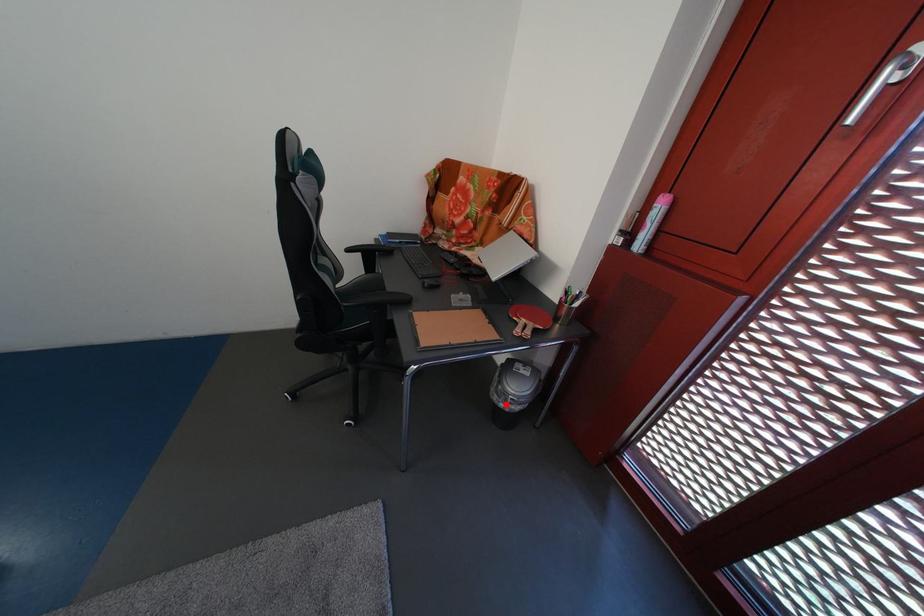
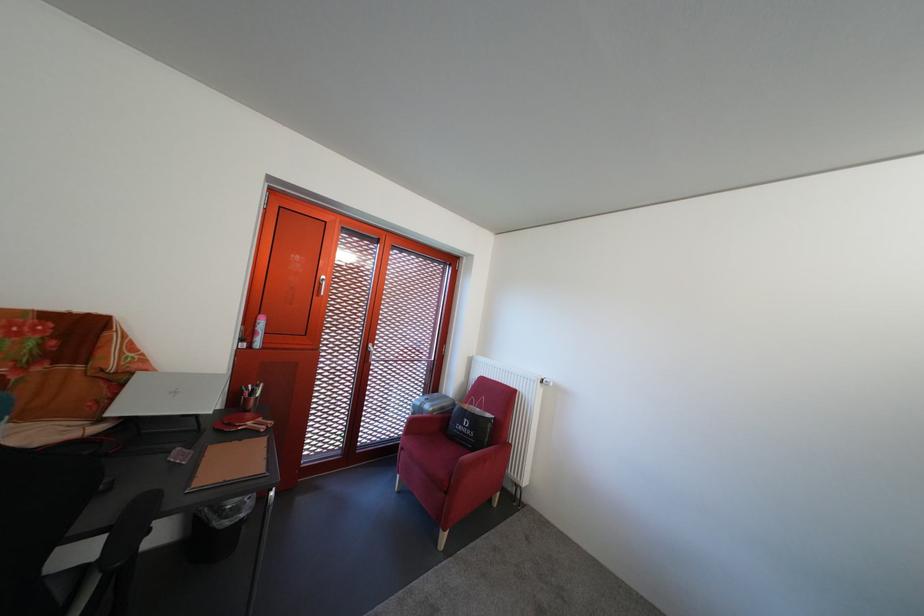
Find the pixel in the second image that matches the highlighted location in the first image.

(237, 530)